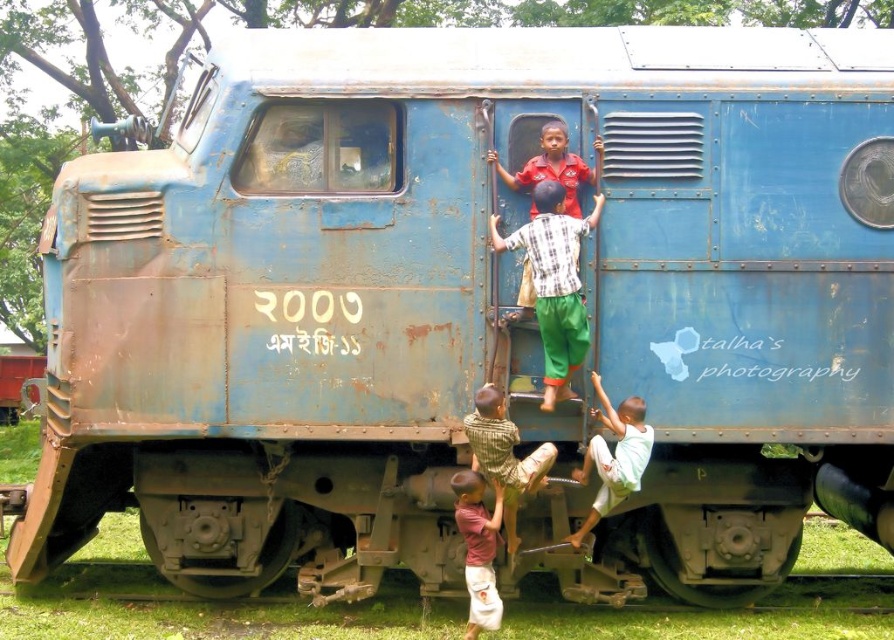
Question: Is checkered fabric shirt at center above white cotton pants at lower right?

Choices:
 (A) yes
 (B) no

Answer: (A)

Question: Which is nearer to the matte pink shirt at lower center?

Choices:
 (A) matte red shirt at center
 (B) white cotton pants at lower right

Answer: (B)

Question: Which object appears closest to the camera in this image?

Choices:
 (A) white cotton pants at lower right
 (B) matte pink shirt at lower center

Answer: (B)

Question: Can you confirm if checkered fabric shirt at center is positioned to the right of white cotton pants at lower right?

Choices:
 (A) no
 (B) yes

Answer: (A)

Question: Among these objects, which one is farthest from the camera?

Choices:
 (A) matte red shirt at center
 (B) matte pink shirt at lower center

Answer: (A)

Question: Does checkered fabric shirt at center lie in front of striped cotton shirt at lower center?

Choices:
 (A) no
 (B) yes

Answer: (A)